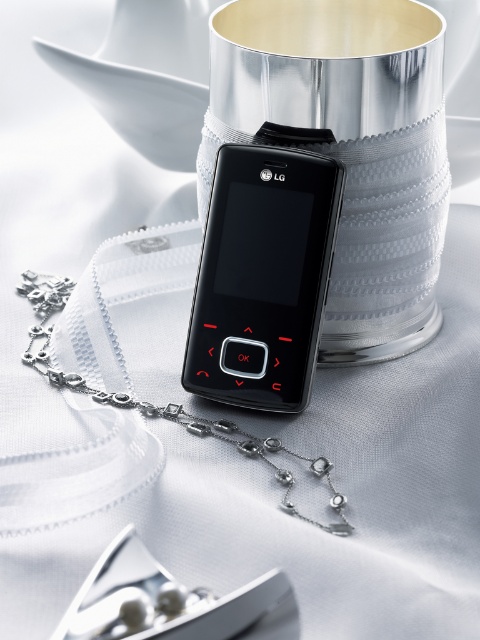
You are designing a display case for a tech exhibition. The case has a shelf that can only hold items up to the size of the silver metallic chain at center. Can the black matte lg phone at center fit on the same shelf without exceeding the size limit?

The black matte lg phone at center is smaller than the silver metallic chain at center, so it will fit on the shelf designed for the size of the silver metallic chain at center.

You are an interior designer analyzing the placement of two points in a room. The first point is at coordinate point (197, 323) and the second is at coordinate point (337, 499). Based on the scene provided, which point is closer to you?

Point (197, 323) is closer to you than point (337, 499) because it is further to the viewer according to the description.

You are a jeweler who needs to place both the black matte lg phone at center and the silver metallic chain at center into a rectangular box. The box can only accommodate items with a maximum width of 10 cm. Which item will fit better in the box?

The black matte lg phone at center has a smaller width than the silver metallic chain at center, so it will fit better in the rectangular box with a maximum width of 10 cm.